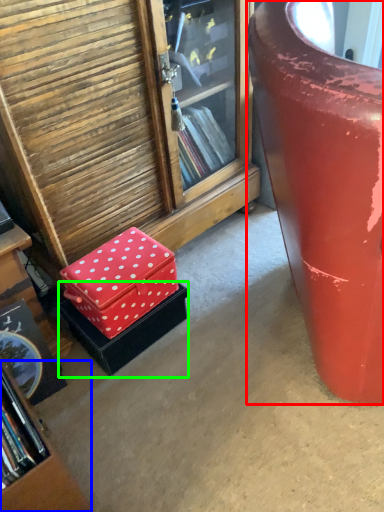
Question: Which is nearer to the furniture (highlighted by a red box)? bookcase (highlighted by a blue box) or box (highlighted by a green box).

Choices:
 (A) bookcase
 (B) box

Answer: (B)